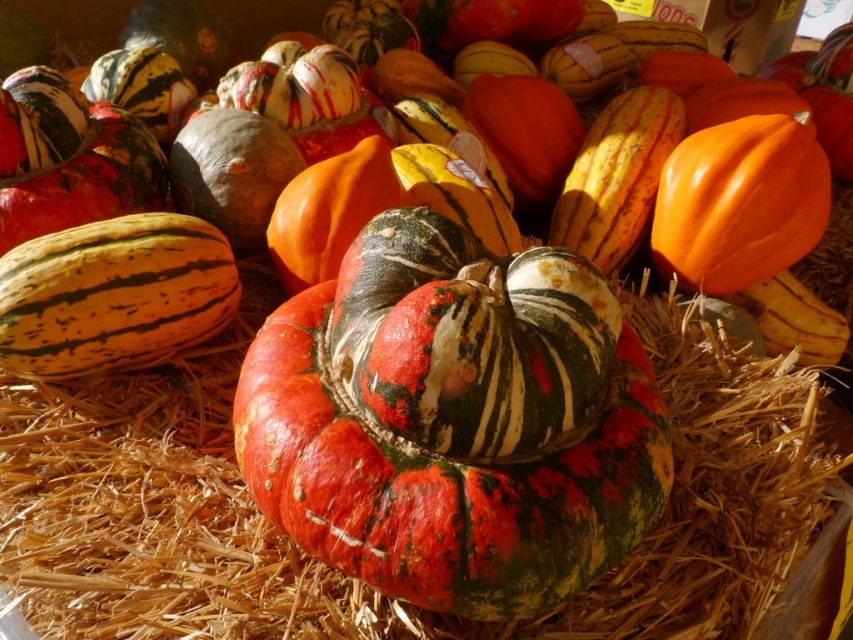
Does point (782, 449) come behind point (548, 282)?

Yes, point (782, 449) is farther from viewer.

Which of these two, textured straw at center or speckled orange and green gourd at center, stands shorter?

speckled orange and green gourd at center is shorter.

Which is behind, point (720, 625) or point (488, 266)?

The point (720, 625) is behind.

In order to click on textured straw at center in this screenshot , I will do 358,580.